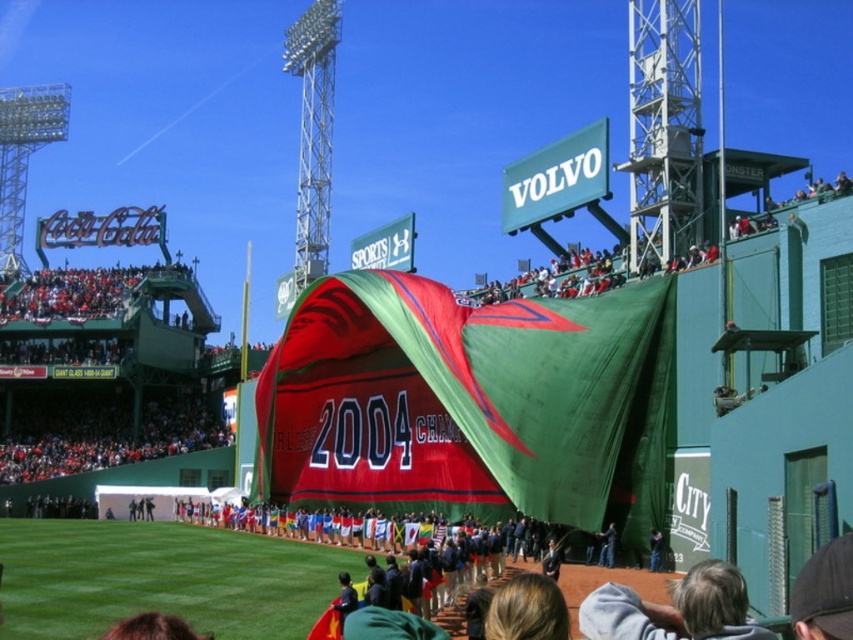
You are a photographer at the baseball stadium and want to capture a photo of the dark blue jeans at center and the green fabric person at lower center. Which object should you focus on first to ensure both are in the frame without moving the camera?

The dark blue jeans at center is wider than the green fabric person at lower center, so you should focus on the dark blue jeans at center first to ensure both fit in the frame.

Looking at this image, you are a photographer at the baseball stadium and want to capture a photo of the dark blue jeans at center without the green fabric person at lower center blocking it. Is this possible based on their positions?

The dark blue jeans at center is positioned under the green fabric person at lower center, so the green fabric person would block the view of the dark blue jeans. Therefore, it is not possible to capture the dark blue jeans at center without the green fabric person at lower center blocking it.